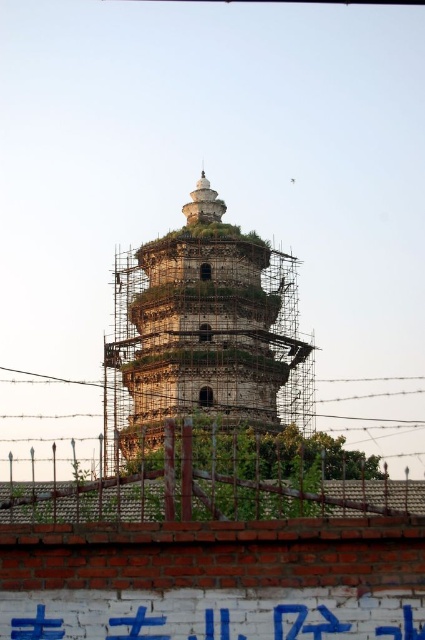
Question: Which of the following is the farthest from the observer?

Choices:
 (A) brick fence at lower center
 (B) stone pagoda at center

Answer: (B)

Question: Estimate the real-world distances between objects in this image. Which object is farther from the stone pagoda at center?

Choices:
 (A) white painted brick wall at lower center
 (B) barbed wire at lower center

Answer: (A)

Question: Is brick fence at lower center thinner than white painted brick wall at lower center?

Choices:
 (A) yes
 (B) no

Answer: (B)

Question: Is stone pagoda at center smaller than barbed wire at lower center?

Choices:
 (A) no
 (B) yes

Answer: (A)

Question: In this image, where is stone pagoda at center located relative to white painted brick wall at lower center?

Choices:
 (A) below
 (B) above

Answer: (B)

Question: Which of the following is the closest to the observer?

Choices:
 (A) brick fence at lower center
 (B) stone pagoda at center

Answer: (A)